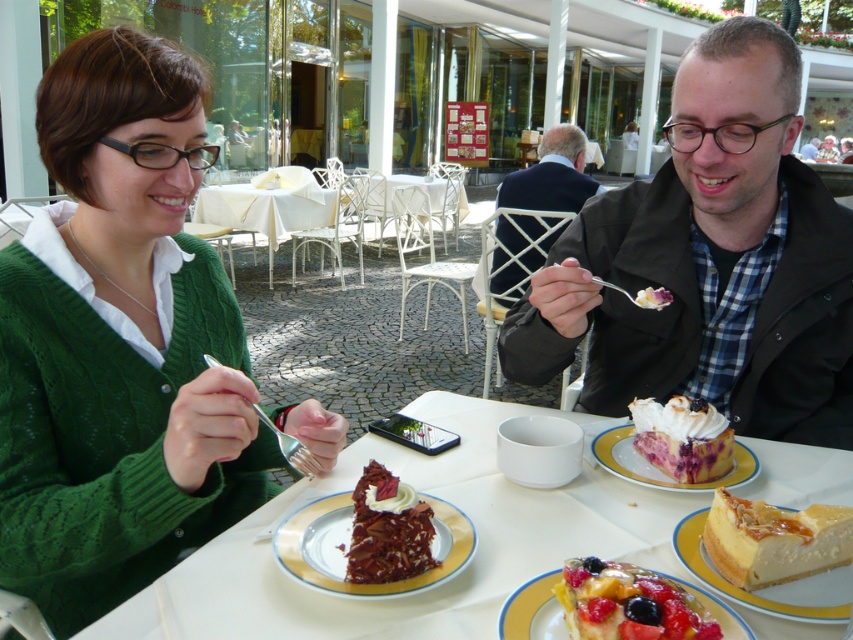
Question: Where is gold/glossy plate at center located in relation to white fabric table at center in the image?

Choices:
 (A) below
 (B) above

Answer: (A)

Question: Is matte black jacket at right thinner than white plastic table at center?

Choices:
 (A) yes
 (B) no

Answer: (A)

Question: Is smooth caramel cheesecake at center thinner than frosted fruit cake at center?

Choices:
 (A) yes
 (B) no

Answer: (B)

Question: Estimate the real-world distances between objects in this image. Which object is closer to the matte black jacket at upper right?

Choices:
 (A) green knitted sweater at left
 (B) white plastic table at center
 (C) frosted fruit cake at center

Answer: (B)

Question: Which of the following is the closest to the observer?

Choices:
 (A) (837, 154)
 (B) (212, 364)

Answer: (B)

Question: Among these points, which one is nearest to the camera?

Choices:
 (A) (x=437, y=211)
 (B) (x=701, y=387)

Answer: (B)